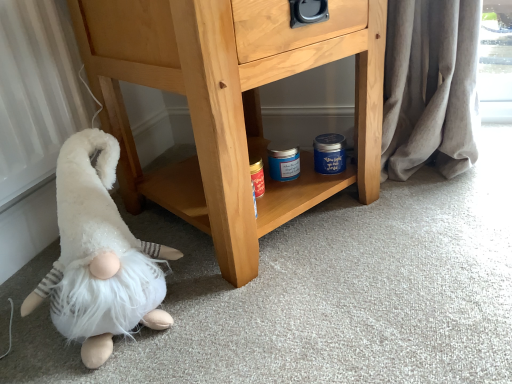
Locate an element on the screen. Image resolution: width=512 pixels, height=384 pixels. spots to the right of light brown wood chest of drawers at center is located at coordinates click(x=432, y=211).